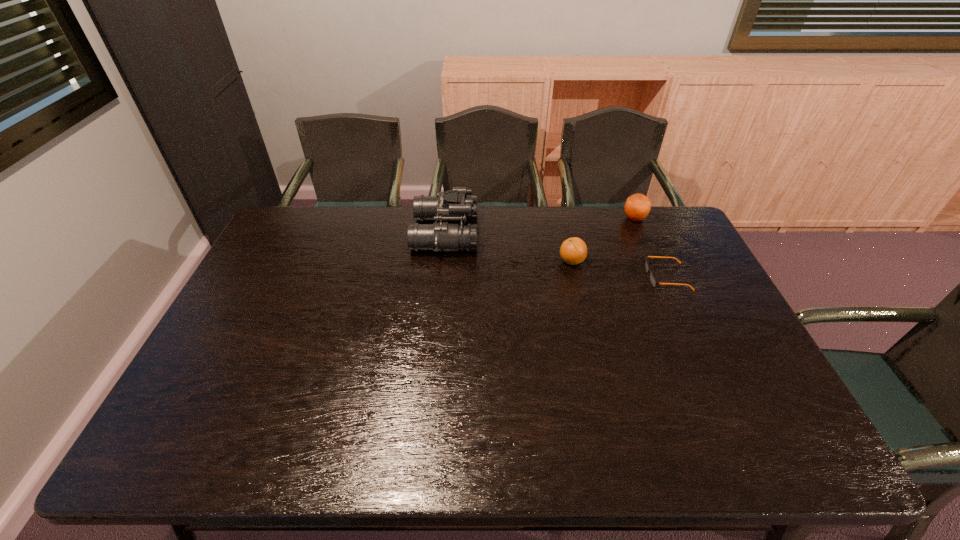
Where is `vacant region located on the front-facing side of the spectacles`? vacant region located on the front-facing side of the spectacles is located at coordinates (580, 277).

You are a GUI agent. You are given a task and a screenshot of the screen. Output one action in this format:
    pyautogui.click(x=<x>, y=<y>)
    Task: Click on the vacant region located on the front-facing side of the spectacles
    
    Given the screenshot: What is the action you would take?
    pyautogui.click(x=529, y=277)

You are a GUI agent. You are given a task and a screenshot of the screen. Output one action in this format:
    pyautogui.click(x=<x>, y=<y>)
    Task: Click on the binoculars positioned at the far edge
    The width and height of the screenshot is (960, 540).
    Given the screenshot: What is the action you would take?
    pyautogui.click(x=454, y=205)

The image size is (960, 540). Find the location of `orange present at the far edge`. orange present at the far edge is located at coordinates 637,207.

Identify the location of orange that is at the right edge. Image resolution: width=960 pixels, height=540 pixels. (x=637, y=207).

This screenshot has height=540, width=960. I want to click on spectacles that is at the right edge, so click(x=653, y=281).

I want to click on object situated at the far right corner, so click(x=637, y=207).

Where is `free space at the far edge of the desktop`? free space at the far edge of the desktop is located at coordinates (484, 211).

In the image, there is a desktop. Identify the location of vacant region at the near edge. point(565,448).

In the image, there is a desktop. Where is `vacant space at the left edge`? vacant space at the left edge is located at coordinates (197, 422).